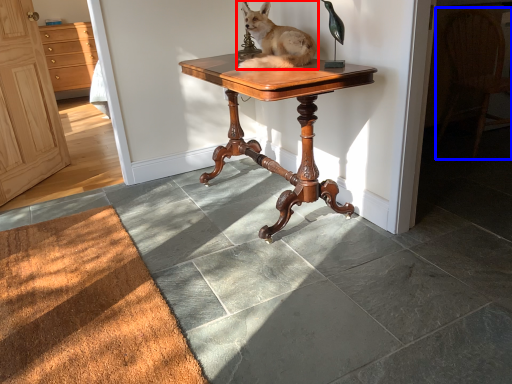
Question: Among these objects, which one is farthest to the camera, dog (highlighted by a red box) or chair (highlighted by a blue box)?

Choices:
 (A) dog
 (B) chair

Answer: (B)